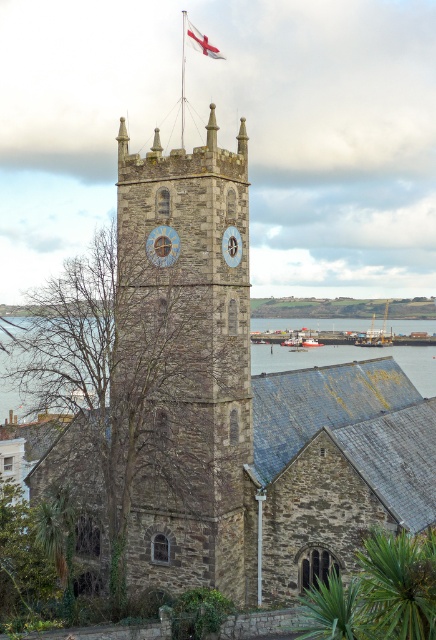
Is red fabric flag at upper center closer to camera compared to blue stone clock at center?

That is False.

Between red fabric flag at upper center and blue stone clock at center, which one appears on the right side from the viewer's perspective?

blue stone clock at center

Does point (211, 54) come in front of point (231, 253)?

No.

Image resolution: width=436 pixels, height=640 pixels. Find the location of `red fabric flag at upper center`. red fabric flag at upper center is located at coordinates (200, 40).

Between point (429, 371) and point (197, 49), which one is positioned in front?

Positioned in front is point (197, 49).

Who is shorter, blue water at lower right or red fabric flag at upper center?

blue water at lower right

Is point (0, 365) farther from camera compared to point (207, 44)?

No, it is not.

In order to click on blue water at lower right in this screenshot , I will do `click(350, 360)`.

You are a GUI agent. You are given a task and a screenshot of the screen. Output one action in this format:
    pyautogui.click(x=<x>, y=<y>)
    Task: Click on the stone clock tower at center
    
    Given the screenshot: What is the action you would take?
    pyautogui.click(x=186, y=362)

Who is positioned more to the left, stone clock tower at center or red fabric flag at upper center?

stone clock tower at center is more to the left.

The width and height of the screenshot is (436, 640). Describe the element at coordinates (186, 362) in the screenshot. I see `stone clock tower at center` at that location.

You are a GUI agent. You are given a task and a screenshot of the screen. Output one action in this format:
    pyautogui.click(x=<x>, y=<y>)
    Task: Click on the stone clock tower at center
    
    Given the screenshot: What is the action you would take?
    pyautogui.click(x=186, y=362)